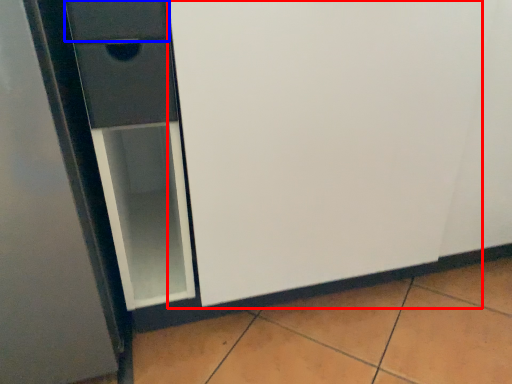
Question: Which object is closer to the camera taking this photo, screen door (highlighted by a red box) or drawer (highlighted by a blue box)?

Choices:
 (A) screen door
 (B) drawer

Answer: (A)